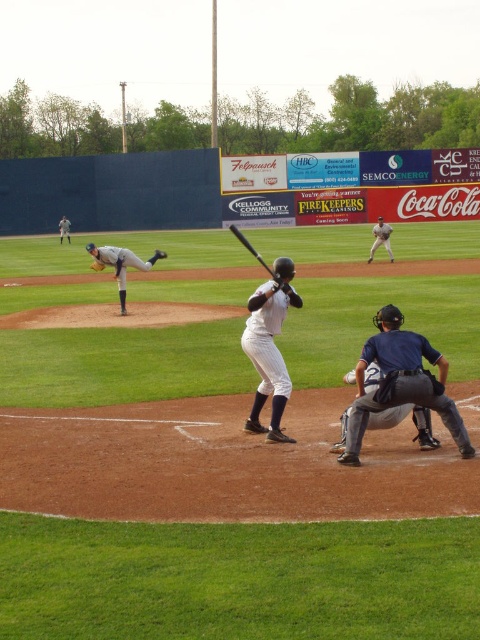
Question: Which point is farther from the camera taking this photo?

Choices:
 (A) (120, 250)
 (B) (346, 442)
 (C) (382, 221)
 (D) (99, 269)

Answer: (C)

Question: In this image, where is gray uniformed pitcher at center located relative to black matte bat at center?

Choices:
 (A) left
 (B) right

Answer: (A)

Question: Which point is farther to the camera?

Choices:
 (A) (62, 228)
 (B) (98, 268)
 (C) (163, 250)
 (D) (453, 433)

Answer: (A)

Question: Which of the following is the farthest from the observer?

Choices:
 (A) (381, 234)
 (B) (60, 230)
 (C) (398, 355)
 (D) (115, 269)

Answer: (B)

Question: Is brown leather glove at center bigger than brown leather glove at upper left?

Choices:
 (A) yes
 (B) no

Answer: (A)

Question: Does white uniformed pitcher at left appear on the left side of brown leather glove at center?

Choices:
 (A) yes
 (B) no

Answer: (A)